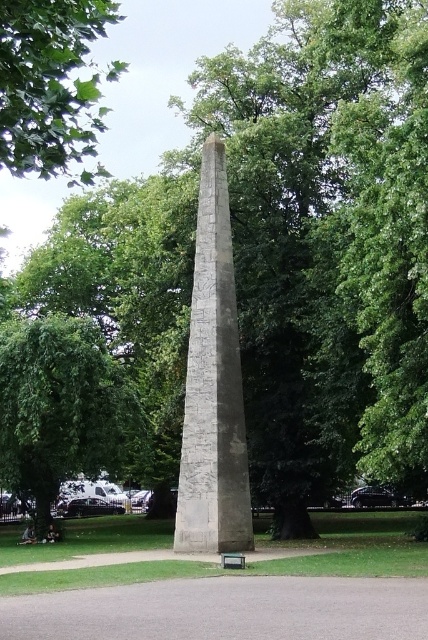
Question: Is gray stone obelisk at center bigger than green leafy tree at upper left?

Choices:
 (A) yes
 (B) no

Answer: (B)

Question: Which object is farther from the camera taking this photo?

Choices:
 (A) green leafy tree at upper left
 (B) green leafy tree at lower left

Answer: (B)

Question: Can you confirm if green leafy tree at lower left is thinner than green painted wood park bench at lower center?

Choices:
 (A) no
 (B) yes

Answer: (A)

Question: Does gray stone obelisk at center appear on the right side of green leafy tree at upper left?

Choices:
 (A) no
 (B) yes

Answer: (B)

Question: Which point is farther to the camera?

Choices:
 (A) green leafy tree at lower left
 (B) green leafy tree at upper left
 (C) green painted wood park bench at lower center
 (D) gray stone obelisk at center

Answer: (A)

Question: Which point is farther from the camera taking this photo?

Choices:
 (A) (32, 170)
 (B) (237, 554)

Answer: (B)